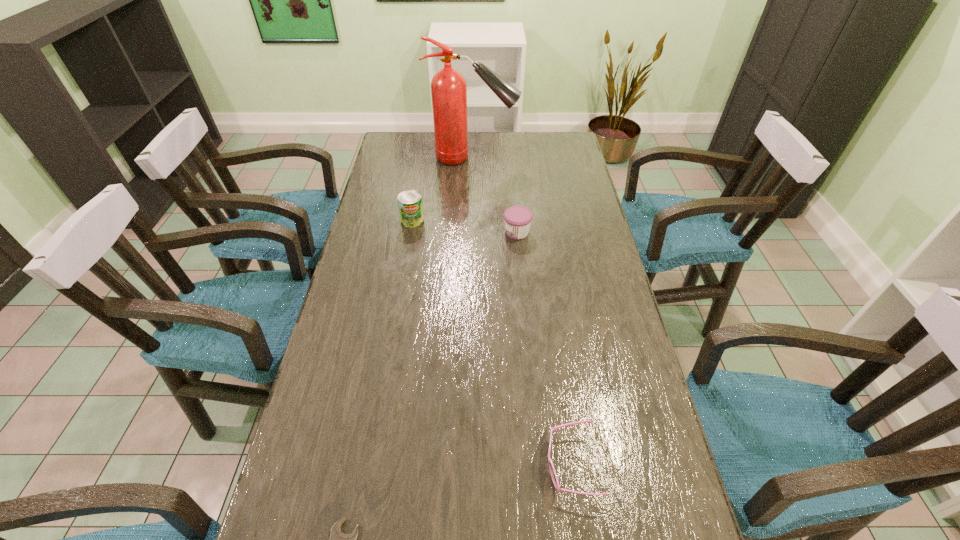
In the image, there is a desktop. Find the location of `vacant region at the far left corner`. vacant region at the far left corner is located at coordinates (407, 150).

Locate an element on the screen. The height and width of the screenshot is (540, 960). vacant position at the far right corner of the desktop is located at coordinates pyautogui.click(x=540, y=153).

Where is `empty location between the jam and the can`? The width and height of the screenshot is (960, 540). empty location between the jam and the can is located at coordinates (465, 226).

Where is `free space between the fire extinguisher and the can`? The height and width of the screenshot is (540, 960). free space between the fire extinguisher and the can is located at coordinates pyautogui.click(x=443, y=189).

Where is `blank region between the jam and the fire extinguisher`? blank region between the jam and the fire extinguisher is located at coordinates (494, 195).

The width and height of the screenshot is (960, 540). In order to click on free spot between the third shortest object and the can in this screenshot , I will do `click(465, 226)`.

The image size is (960, 540). In order to click on free point between the can and the third shortest object in this screenshot , I will do `click(465, 226)`.

Image resolution: width=960 pixels, height=540 pixels. Identify the location of blank region between the sunglasses and the can. (492, 343).

Locate an element on the screen. This screenshot has height=540, width=960. free area in between the sunglasses and the jam is located at coordinates (543, 349).

The height and width of the screenshot is (540, 960). Identify the location of free space between the fire extinguisher and the sunglasses. coord(521,312).